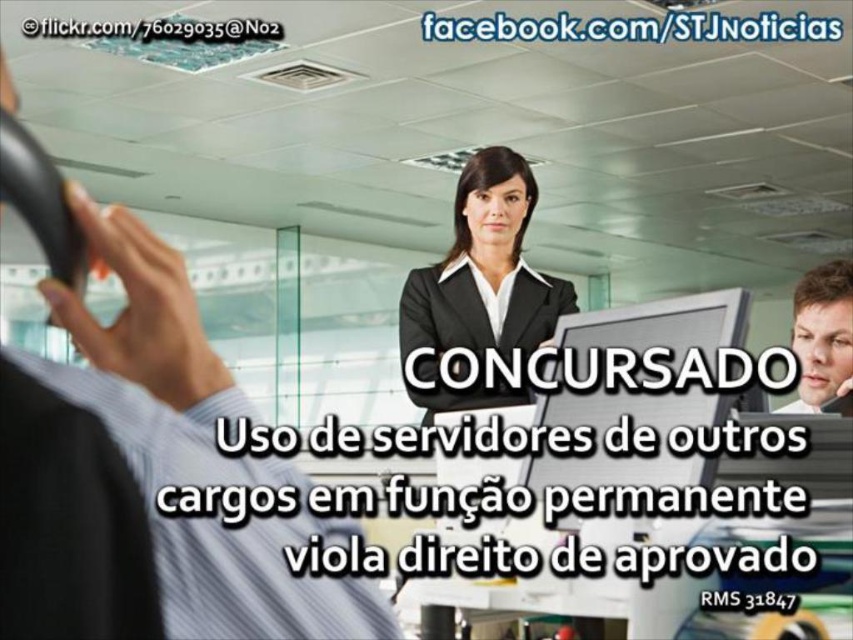
How far apart are black matte suit at center and matte black monitor at center?

The distance of black matte suit at center from matte black monitor at center is 18.21 inches.

This screenshot has height=640, width=853. What do you see at coordinates (480, 285) in the screenshot?
I see `black matte suit at center` at bounding box center [480, 285].

Identify the location of black matte suit at center. This screenshot has width=853, height=640. (480, 285).

Does matte black monitor at center have a greater width compared to smooth skin face at center?

Incorrect, matte black monitor at center's width does not surpass smooth skin face at center's.

The height and width of the screenshot is (640, 853). Identify the location of matte black monitor at center. (633, 426).

Which is more to the right, black matte suit at center or smooth skin face at center?

Positioned to the right is smooth skin face at center.

Locate an element on the screen. Image resolution: width=853 pixels, height=640 pixels. black matte suit at center is located at coordinates (480, 285).